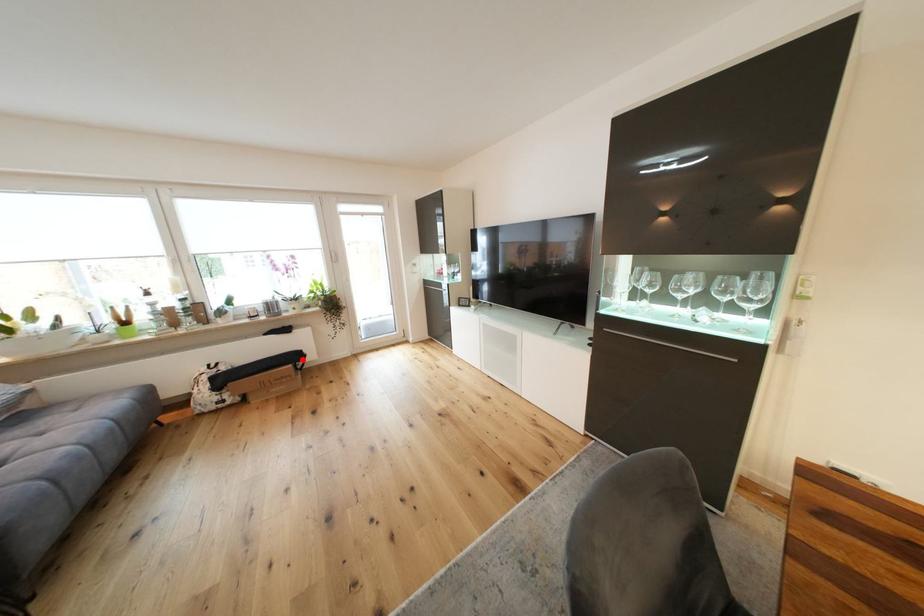
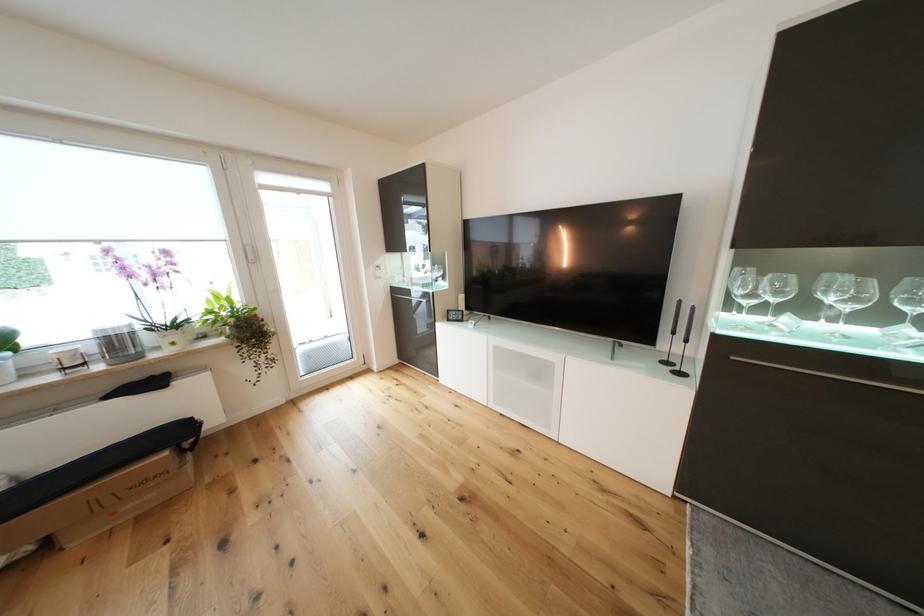
Where in the second image is the point corresponding to the highlighted location from the first image?

(186, 435)